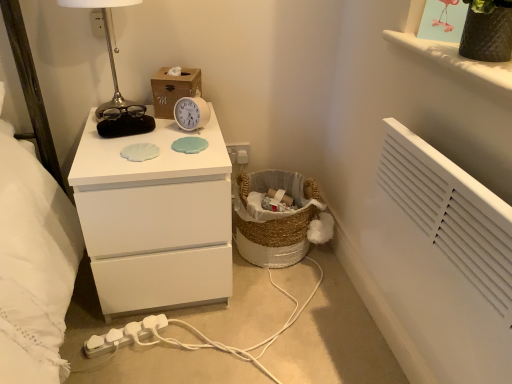
I want to click on woven natural basket at lower center, so click(x=274, y=219).

Image resolution: width=512 pixels, height=384 pixels. What do you see at coordinates (274, 219) in the screenshot?
I see `woven natural basket at lower center` at bounding box center [274, 219].

What is the approximate height of white plastic electric outlet at upper center?

white plastic electric outlet at upper center is 2.70 inches tall.

What is the approximate height of textured brown vase at upper right?

It is 8.49 inches.

Describe the element at coordinates (191, 113) in the screenshot. The image size is (512, 384). I see `white plastic alarm clock at center` at that location.

At what (x,y) coordinates should I click in order to perform the action: click on white matte chest of drawers at center. Please return your answer as a coordinate pair (x, y). Looking at the image, I should click on (155, 219).

Can you confirm if textured brown vase at upper right is positioned to the right of wooden tissue box at upper center?

Correct, you'll find textured brown vase at upper right to the right of wooden tissue box at upper center.

Does textured brown vase at upper right turn towards wooden tissue box at upper center?

No, textured brown vase at upper right is not aimed at wooden tissue box at upper center.

Where is `vase lying above the wooden tissue box at upper center (from the image's perspective)`? The width and height of the screenshot is (512, 384). vase lying above the wooden tissue box at upper center (from the image's perspective) is located at coordinates (487, 36).

Considering the relative sizes of textured brown vase at upper right and wooden tissue box at upper center in the image provided, is textured brown vase at upper right taller than wooden tissue box at upper center?

Indeed, textured brown vase at upper right has a greater height compared to wooden tissue box at upper center.

Which is closer to the camera, (508, 29) or (154, 318)?

The point (508, 29) is closer.

How different are the orientations of textured brown vase at upper right and white plastic extension cord at lower left in degrees?

The angle between the facing direction of textured brown vase at upper right and the facing direction of white plastic extension cord at lower left is 64.5 degrees.

From the picture: Is textured brown vase at upper right shorter than white plastic extension cord at lower left?

No.

Does textured brown vase at upper right have a lesser width compared to white plastic extension cord at lower left?

No.

Locate an element on the screen. The image size is (512, 384). alarm clock behind the matte black vase at upper right is located at coordinates (191, 113).

Considering the sizes of objects white plastic alarm clock at center and matte black vase at upper right in the image provided, who is bigger, white plastic alarm clock at center or matte black vase at upper right?

matte black vase at upper right is bigger.

From a real-world perspective, is white plastic alarm clock at center located beneath matte black vase at upper right?

Yes, from a real-world perspective, white plastic alarm clock at center is below matte black vase at upper right.

Is white plastic alarm clock at center thinner than metallic silver table lamp at upper left?

Yes, white plastic alarm clock at center is thinner than metallic silver table lamp at upper left.

Is point (187, 124) positioned after point (117, 102)?

No.

Identify the location of table lamp on the left of the white plastic alarm clock at center. The width and height of the screenshot is (512, 384). (106, 45).

How different are the orientations of white plastic alarm clock at center and metallic silver table lamp at upper left in degrees?

white plastic alarm clock at center and metallic silver table lamp at upper left are facing 32.2 degrees away from each other.

Considering the sizes of metallic silver table lamp at upper left and wooden tissue box at upper center in the image, is metallic silver table lamp at upper left wider or thinner than wooden tissue box at upper center?

metallic silver table lamp at upper left is wider than wooden tissue box at upper center.

Considering their positions, is metallic silver table lamp at upper left located in front of or behind wooden tissue box at upper center?

metallic silver table lamp at upper left is positioned closer to the viewer than wooden tissue box at upper center.

What are the coordinates of `cardboard box on the right of metallic silver table lamp at upper left` in the screenshot? It's located at (173, 89).

Would you say metallic silver table lamp at upper left is a long distance from wooden tissue box at upper center?

They are positioned close to each other.

From the picture: How far apart are white plastic electric outlet at upper center and matte black vase at upper right?

white plastic electric outlet at upper center is 39.11 inches away from matte black vase at upper right.

Is matte black vase at upper right at the back of white plastic electric outlet at upper center?

No, matte black vase at upper right is not at the back of white plastic electric outlet at upper center.

Can you confirm if white plastic electric outlet at upper center is shorter than matte black vase at upper right?

Incorrect, the height of white plastic electric outlet at upper center does not fall short of that of matte black vase at upper right.

Is white plastic electric outlet at upper center situated inside matte black vase at upper right or outside?

white plastic electric outlet at upper center is spatially situated outside matte black vase at upper right.

From the picture: Does metallic silver table lamp at upper left turn towards white plastic electric outlet at upper center?

No, metallic silver table lamp at upper left is not turned towards white plastic electric outlet at upper center.

From the image's perspective, is metallic silver table lamp at upper left under white plastic electric outlet at upper center?

Correct, metallic silver table lamp at upper left appears lower than white plastic electric outlet at upper center in the image.

Is metallic silver table lamp at upper left to the right of white plastic electric outlet at upper center from the viewer's perspective?

Correct, you'll find metallic silver table lamp at upper left to the right of white plastic electric outlet at upper center.

You are a GUI agent. You are given a task and a screenshot of the screen. Output one action in this format:
    pyautogui.click(x=<x>, y=<y>)
    Task: Click on the electric outlet on the left of the metallic silver table lamp at upper left
    This screenshot has height=384, width=512.
    Given the screenshot: What is the action you would take?
    pyautogui.click(x=97, y=23)

The height and width of the screenshot is (384, 512). I want to click on vase in front of the wooden tissue box at upper center, so click(487, 36).

What are the coordinates of `vase that appears on the right of white plastic extension cord at lower left` in the screenshot? It's located at (487, 36).

Based on their spatial positions, is textured brown vase at upper right or metallic silver table lamp at upper left further from wooden tissue box at upper center?

Among the two, textured brown vase at upper right is located further to wooden tissue box at upper center.

Looking at the image, which one is located further to white plastic alarm clock at center, matte black vase at upper right or wooden tissue box at upper center?

matte black vase at upper right is further to white plastic alarm clock at center.

From the image, which object appears to be farther from white matte chest of drawers at center, woven natural basket at lower center or white plastic electric outlet at upper center?

white plastic electric outlet at upper center lies further to white matte chest of drawers at center than the other object.

When comparing their distances from textured brown vase at upper right, does wooden tissue box at upper center or woven natural basket at lower center seem closer?

wooden tissue box at upper center is closer to textured brown vase at upper right.

Looking at this image, based on their spatial positions, is white plastic alarm clock at center or wooden tissue box at upper center further from matte black vase at upper right?

wooden tissue box at upper center is positioned further to the anchor matte black vase at upper right.

Considering their positions, is textured brown vase at upper right positioned further to woven natural basket at lower center than white matte chest of drawers at center?

Among the two, textured brown vase at upper right is located further to woven natural basket at lower center.

Which object lies further to the anchor point woven natural basket at lower center, wooden tissue box at upper center or white plastic alarm clock at center?

Among the two, wooden tissue box at upper center is located further to woven natural basket at lower center.

Considering their positions, is white plastic alarm clock at center positioned closer to white plastic electric outlet at upper center than textured brown vase at upper right?

white plastic alarm clock at center.

Locate an element on the screen. This screenshot has width=512, height=384. cardboard box between metallic silver table lamp at upper left and white plastic electric outlet at upper center from front to back is located at coordinates (173, 89).

Identify the location of basket between white matte chest of drawers at center and textured brown vase at upper right from left to right. (274, 219).

Where is `cardboard box that lies between metallic silver table lamp at upper left and white plastic extension cord at lower left from top to bottom`? cardboard box that lies between metallic silver table lamp at upper left and white plastic extension cord at lower left from top to bottom is located at coordinates (173, 89).

The width and height of the screenshot is (512, 384). I want to click on cardboard box between white plastic extension cord at lower left and matte black vase at upper right in the horizontal direction, so click(x=173, y=89).